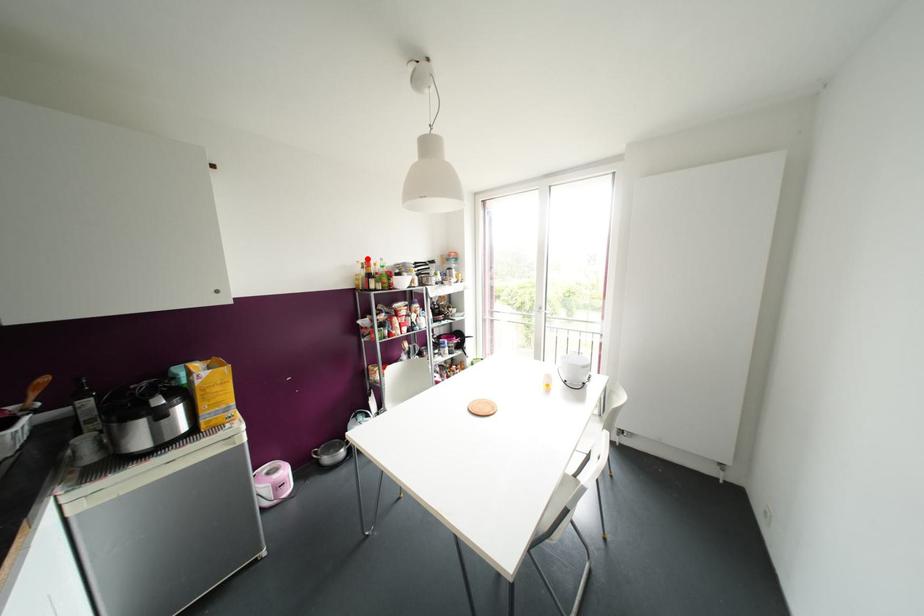
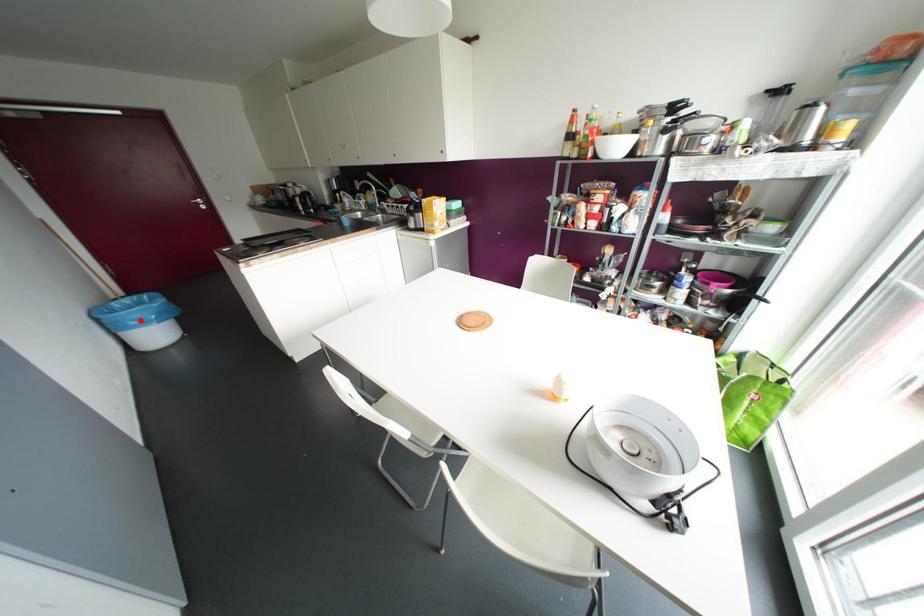
I am providing you with two images of the same scene from different viewpoints. A red point is marked on the first image and another point is marked on the second image. Do the highlighted points in image1 and image2 indicate the same real-world spot?

No